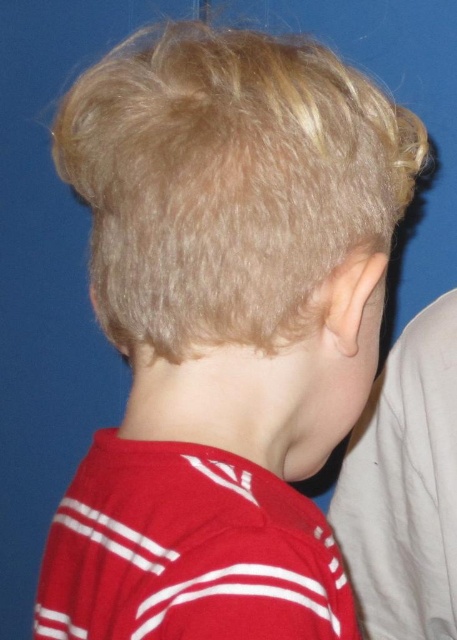
You are a photographer adjusting the lighting for a portrait. The subject is wearing a red striped jersey at center and has a smooth skin ear at center. To ensure both elements are well lit, which object should you focus the light on first considering their sizes?

The red striped jersey at center has a smaller size compared to the smooth skin ear at center, so you should focus the light on the smooth skin ear at center first to ensure proper illumination due to its larger size.

You are a photographer adjusting the focus on a camera. You notice a point at coordinates (187, 552) in the image. Based on the scene description, where is this point located?

The point at coordinates (187, 552) is located on the red striped jersey at center.

You are a tailor measuring a child for a new uniform. You need to ensure the red striped jersey at center fits properly. The seam allowance requires at least 18 inches between the jersey and the smooth skin ear at center. Based on the image, is the current jersey too tight?

The distance between the red striped jersey at center and the smooth skin ear at center is 17.04 inches, which is less than the required 18 inches. Therefore, the current jersey is too tight.